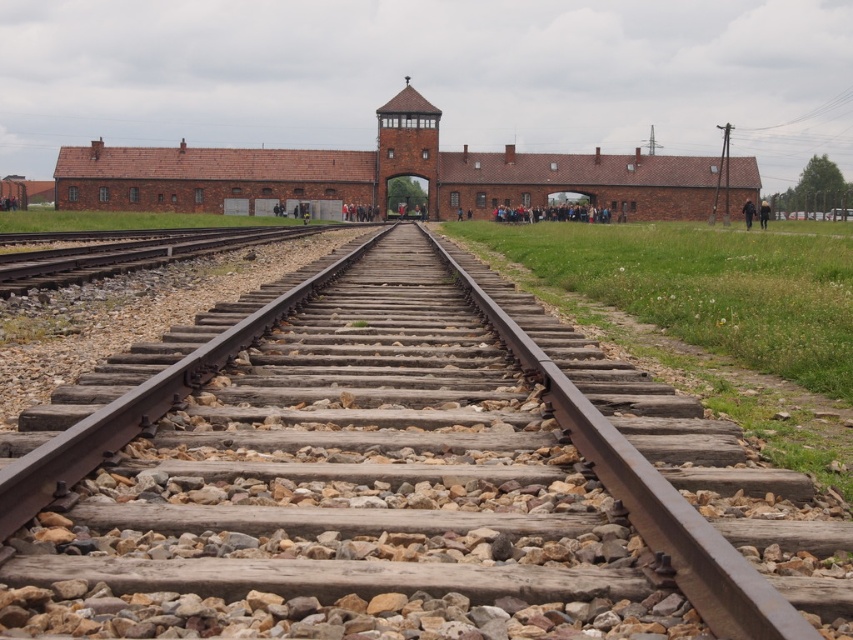
You are a photographer standing at the starting point of the brown wooden track at center and want to place your black leather jacket at center in a way that it is visible from your current position. Given that the jacket is 0.5 meters wide, can you determine if there is enough space between the tracks to place it without blocking the view of the tracks themselves?

The brown wooden track at center and black leather jacket at center are 46.59 meters apart from each other. Since the jacket is only 0.5 meters wide and placed at center, there is sufficient space between the tracks to place it without blocking the view.

You are a photographer standing at the center of the scene. You want to place your camera on the ground between the brown wooden track at center and the black leather jacket at center. Which object should you position your camera closer to in order to avoid blocking the view of the thinner object?

You should position your camera closer to the brown wooden track at center because it is thinner than the black leather jacket at center, so placing the camera near it would prevent blocking its view.